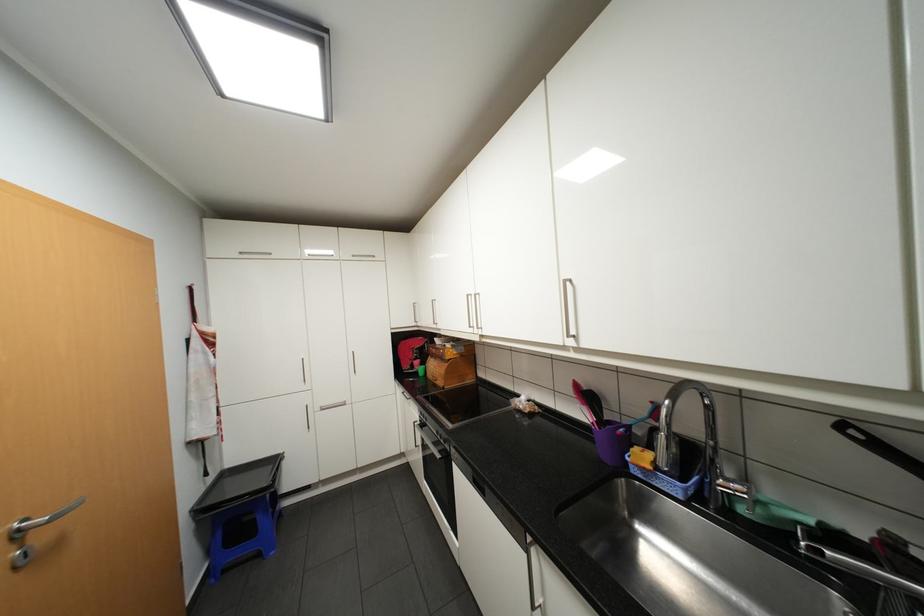
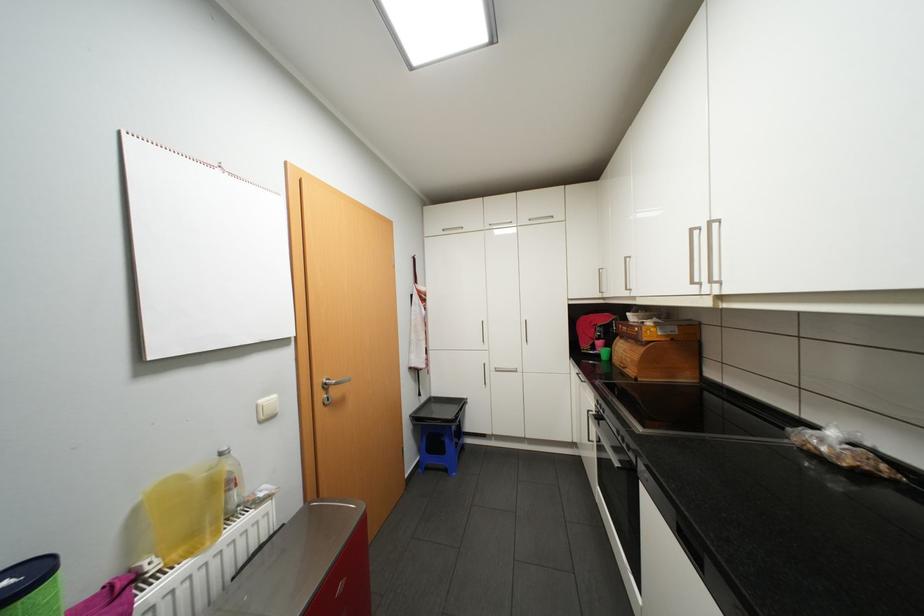
Question: The camera is either moving clockwise (left) or counter-clockwise (right) around the object. The first image is from the beginning of the video and the second image is from the end. Is the camera moving left or right when shooting the video?

Choices:
 (A) Left
 (B) Right

Answer: (B)